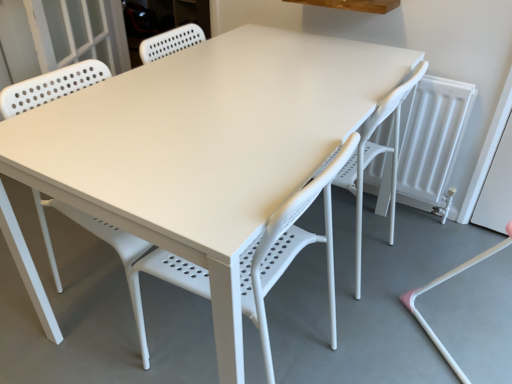
Describe the element at coordinates (289, 249) in the screenshot. This screenshot has height=384, width=512. I see `white plastic chair at center` at that location.

Where is `white plastic chair at center`? This screenshot has width=512, height=384. white plastic chair at center is located at coordinates (289, 249).

What is the approximate width of white plastic chair at center?

The width of white plastic chair at center is 19.08 inches.

Locate an element on the screen. This screenshot has height=384, width=512. white plastic swivel chair at lower right is located at coordinates tap(373, 158).

Describe the element at coordinates (373, 158) in the screenshot. Image resolution: width=512 pixels, height=384 pixels. I see `white plastic swivel chair at lower right` at that location.

Locate an element on the screen. Image resolution: width=512 pixels, height=384 pixels. white plastic chair at center is located at coordinates (289, 249).

Which object is positioned more to the left, white plastic swivel chair at lower right or white plastic chair at center?

white plastic chair at center.

Is white plastic swivel chair at lower right in front of or behind white plastic chair at center in the image?

In the image, white plastic swivel chair at lower right appears behind white plastic chair at center.

Considering the points (364, 166) and (52, 201), which point is in front, point (364, 166) or point (52, 201)?

The point (52, 201) is in front.

From the image's perspective, is white plastic swivel chair at lower right on top of white plastic chair at center?

Indeed, from the image's perspective, white plastic swivel chair at lower right is shown above white plastic chair at center.

From a real-world perspective, which object rests below the other?

white plastic swivel chair at lower right, from a real-world perspective.

Does white plastic swivel chair at lower right have a greater width compared to white plastic chair at center?

Yes, white plastic swivel chair at lower right is wider than white plastic chair at center.

Which of these two, white plastic swivel chair at lower right or white plastic chair at center, stands taller?

white plastic swivel chair at lower right.

Looking at the image, does white plastic swivel chair at lower right seem bigger or smaller compared to white plastic chair at center?

white plastic swivel chair at lower right is bigger than white plastic chair at center.

Would you say white plastic swivel chair at lower right contains white plastic chair at center?

No, white plastic chair at center is not inside white plastic swivel chair at lower right.

Are white plastic swivel chair at lower right and white plastic chair at center far apart?

No, white plastic swivel chair at lower right is in close proximity to white plastic chair at center.

Is white plastic swivel chair at lower right oriented towards white plastic chair at center?

No, white plastic swivel chair at lower right is not aimed at white plastic chair at center.

Can you tell me how much white plastic swivel chair at lower right and white plastic chair at center differ in facing direction?

white plastic swivel chair at lower right and white plastic chair at center are facing 0.00121 degrees away from each other.

The image size is (512, 384). Identify the location of swivel chair behind the white plastic chair at center. (373, 158).

Consider the image. In the image, is white plastic chair at center on the left side or the right side of white plastic swivel chair at lower right?

Based on their positions, white plastic chair at center is located to the left of white plastic swivel chair at lower right.

Does white plastic chair at center come in front of white plastic swivel chair at lower right?

Yes, white plastic chair at center is closer to the camera.

Is point (108, 238) farther from viewer compared to point (385, 117)?

No, it is not.

From the image's perspective, is white plastic chair at center above white plastic swivel chair at lower right?

Actually, white plastic chair at center appears below white plastic swivel chair at lower right in the image.

From a real-world perspective, is white plastic chair at center over white plastic swivel chair at lower right?

Yes, from a real-world perspective, white plastic chair at center is on top of white plastic swivel chair at lower right.

Which object is thinner, white plastic chair at center or white plastic swivel chair at lower right?

With smaller width is white plastic chair at center.

In terms of height, does white plastic chair at center look taller or shorter compared to white plastic swivel chair at lower right?

Considering their sizes, white plastic chair at center has less height than white plastic swivel chair at lower right.

From the picture: Which of these two, white plastic chair at center or white plastic swivel chair at lower right, is smaller?

Smaller between the two is white plastic chair at center.

Is white plastic chair at center outside of white plastic swivel chair at lower right?

Yes.

Is there a large distance between white plastic chair at center and white plastic swivel chair at lower right?

white plastic chair at center is actually quite close to white plastic swivel chair at lower right.

Is white plastic chair at center facing towards white plastic swivel chair at lower right?

No.

How different are the orientations of white plastic chair at center and white plastic swivel chair at lower right in degrees?

There is a 0.00121-degree angle between the facing directions of white plastic chair at center and white plastic swivel chair at lower right.

I want to click on chair to the left of white plastic swivel chair at lower right, so click(289, 249).

I want to click on swivel chair on the right of white plastic chair at center, so pyautogui.click(x=373, y=158).

Where is `chair below the white plastic swivel chair at lower right (from the image's perspective)`? This screenshot has height=384, width=512. chair below the white plastic swivel chair at lower right (from the image's perspective) is located at coordinates (289, 249).